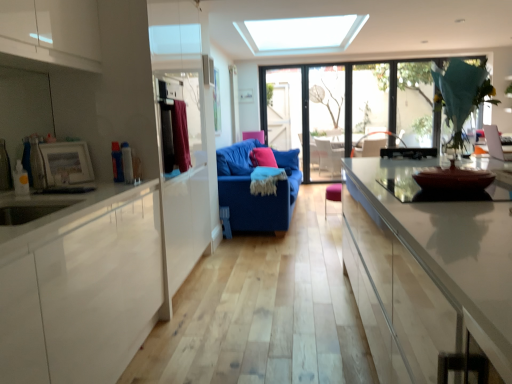
The height and width of the screenshot is (384, 512). What do you see at coordinates (281, 107) in the screenshot?
I see `blue fabric couch at center` at bounding box center [281, 107].

Locate an element on the screen. The image size is (512, 384). transparent glass window at upper right, the 2th window when ordered from left to right is located at coordinates (415, 103).

The image size is (512, 384). Identify the location of transparent glass door at center. (324, 122).

Where is `pink fabric pillow at center`? The width and height of the screenshot is (512, 384). pink fabric pillow at center is located at coordinates (263, 157).

In the scene shown: Is pink fabric pillow at center oriented away from blue fabric couch at center?

No, blue fabric couch at center is not at the back of pink fabric pillow at center.

Is pink fabric pillow at center not within blue fabric couch at center?

Yes, pink fabric pillow at center is located beyond the bounds of blue fabric couch at center.

From the image's perspective, which is above, pink fabric pillow at center or blue fabric couch at center?

blue fabric couch at center, from the image's perspective.

Which is nearer, (257,162) or (270,146)?

Point (257,162) appears to be closer to the viewer than point (270,146).

From a real-world perspective, is transparent glass window at upper right, the 2th window when ordered from left to right, positioned under pink fabric armchair at center based on gravity?

No, from a real-world perspective, transparent glass window at upper right, the 2th window when ordered from left to right, is not under pink fabric armchair at center.

Is there a large distance between transparent glass window at upper right, the 2th window when ordered from left to right, and pink fabric armchair at center?

Yes, transparent glass window at upper right, the 2th window when ordered from left to right, and pink fabric armchair at center are quite far apart.

Considering the relative sizes of transparent glass window at upper right, the 2th window when ordered from left to right, and pink fabric armchair at center in the image provided, is transparent glass window at upper right, the 2th window when ordered from left to right, bigger than pink fabric armchair at center?

Yes.

From the image's perspective, is blue fabric couch at center beneath transparent glass window at center, the second window when ordered from right to left?

No, from the image's perspective, blue fabric couch at center is not below transparent glass window at center, the second window when ordered from right to left.

Between blue fabric couch at center and transparent glass window at center, which is counted as the first window, starting from the left, which one has smaller size?

blue fabric couch at center is smaller.

Is blue fabric couch at center thinner than transparent glass window at center, the second window when ordered from right to left?

In fact, blue fabric couch at center might be wider than transparent glass window at center, the second window when ordered from right to left.

How different are the orientations of blue fabric couch at center and transparent glass window at center, which is counted as the first window, starting from the left, in degrees?

They differ by 2.46 degrees in their facing directions.

Is velvet burgundy curtain at left facing towards pink fabric armchair at center?

No, velvet burgundy curtain at left is not turned towards pink fabric armchair at center.

Is velvet burgundy curtain at left inside or outside of pink fabric armchair at center?

velvet burgundy curtain at left cannot be found inside pink fabric armchair at center.

Can you tell me how much velvet burgundy curtain at left and pink fabric armchair at center differ in facing direction?

The angular difference between velvet burgundy curtain at left and pink fabric armchair at center is 6.83 degrees.

Locate an element on the screen. The height and width of the screenshot is (384, 512). curtain lying on the left of pink fabric armchair at center is located at coordinates (180, 136).

Is transparent glass window at center, which is counted as the first window, starting from the left, not within transparent glass window at upper right, arranged as the first window when viewed from the right?

Yes.

From the image's perspective, would you say transparent glass window at center, which is counted as the first window, starting from the left, is shown under transparent glass window at upper right, arranged as the first window when viewed from the right?

Yes.

Consider the image. Is transparent glass window at center, the second window when ordered from right to left, at the right side of transparent glass window at upper right, the 2th window when ordered from left to right?

In fact, transparent glass window at center, the second window when ordered from right to left, is to the left of transparent glass window at upper right, the 2th window when ordered from left to right.

This screenshot has height=384, width=512. Identify the location of window below the transparent glass window at upper right, the 2th window when ordered from left to right (from a real-world perspective). (352, 111).

Does pink fabric armchair at center come in front of pink fabric pillow at center?

No.

Is pink fabric armchair at center positioned beyond the bounds of pink fabric pillow at center?

Absolutely, pink fabric armchair at center is external to pink fabric pillow at center.

Considering the relative sizes of pink fabric armchair at center and pink fabric pillow at center in the image provided, is pink fabric armchair at center taller than pink fabric pillow at center?

Incorrect, the height of pink fabric armchair at center is not larger of that of pink fabric pillow at center.

Is pink fabric armchair at center smaller than pink fabric pillow at center?

Actually, pink fabric armchair at center might be larger than pink fabric pillow at center.

Is transparent glass window at upper right, arranged as the first window when viewed from the right, next to transparent glass door at center?

They are not placed beside each other.

From a real-world perspective, between transparent glass window at upper right, the 2th window when ordered from left to right, and transparent glass door at center, who is vertically lower?

transparent glass door at center.

Considering the sizes of transparent glass window at upper right, arranged as the first window when viewed from the right, and transparent glass door at center in the image, is transparent glass window at upper right, arranged as the first window when viewed from the right, taller or shorter than transparent glass door at center?

Clearly, transparent glass window at upper right, arranged as the first window when viewed from the right, is shorter compared to transparent glass door at center.

You are a GUI agent. You are given a task and a screenshot of the screen. Output one action in this format:
    pyautogui.click(x=<x>, y=<y>)
    Task: Click on the glass door that is behind the transparent glass window at upper right, arranged as the first window when viewed from the right
    Image resolution: width=512 pixels, height=384 pixels.
    Given the screenshot: What is the action you would take?
    pyautogui.click(x=324, y=122)

Where is `pillow that is under the blue fabric couch at center (from a real-world perspective)`? The height and width of the screenshot is (384, 512). pillow that is under the blue fabric couch at center (from a real-world perspective) is located at coordinates point(263,157).

From a real-world perspective, which window is the 2nd one above the pink fabric armchair at center? Please provide its 2D coordinates.

[(415, 103)]

Considering their positions, is pink fabric pillow at center positioned closer to blue fabric couch at center than velvet burgundy curtain at left?

The object closer to blue fabric couch at center is pink fabric pillow at center.

Considering their positions, is blue fabric couch at center positioned further to transparent glass window at upper right, arranged as the first window when viewed from the right, than blue fabric couch at center?

blue fabric couch at center is further to transparent glass window at upper right, arranged as the first window when viewed from the right.

Based on their spatial positions, is transparent glass window at center, the second window when ordered from right to left, or blue fabric couch at center closer to brown glossy bowl at right?

transparent glass window at center, the second window when ordered from right to left.

Considering their positions, is pink fabric armchair at center positioned further to brown glossy bowl at right than transparent glass window at center, the second window when ordered from right to left?

The object further to brown glossy bowl at right is transparent glass window at center, the second window when ordered from right to left.

When comparing their distances from pink fabric pillow at center, does transparent glass window at upper right, the 2th window when ordered from left to right, or blue fabric couch at center seem closer?

blue fabric couch at center.

From the image, which object appears to be nearer to pink fabric pillow at center, transparent glass window at upper right, the 2th window when ordered from left to right, or velvet burgundy curtain at left?

Based on the image, velvet burgundy curtain at left appears to be nearer to pink fabric pillow at center.

Based on their spatial positions, is transparent glass window at center, the second window when ordered from right to left, or brown glossy bowl at right further from blue fabric couch at center?

brown glossy bowl at right is further to blue fabric couch at center.

From the image, which object appears to be farther from transparent glass window at upper right, arranged as the first window when viewed from the right, transparent glass window at center, which is counted as the first window, starting from the left, or transparent glass door at center?

The object further to transparent glass window at upper right, arranged as the first window when viewed from the right, is transparent glass door at center.

Where is `glass door located between pink fabric pillow at center and transparent glass window at center, which is counted as the first window, starting from the left, in the left-right direction`? This screenshot has width=512, height=384. glass door located between pink fabric pillow at center and transparent glass window at center, which is counted as the first window, starting from the left, in the left-right direction is located at coordinates (324, 122).

This screenshot has height=384, width=512. In order to click on studio couch located between brown glossy bowl at right and transparent glass window at center, which is counted as the first window, starting from the left, in the depth direction in this screenshot , I will do `click(257, 195)`.

At what (x,y) coordinates should I click in order to perform the action: click on pillow located between blue fabric couch at center and transparent glass door at center in the depth direction. Please return your answer as a coordinate pair (x, y). The image size is (512, 384). Looking at the image, I should click on (263, 157).

The image size is (512, 384). What are the coordinates of `window between transparent glass door at center and transparent glass window at upper right, arranged as the first window when viewed from the right` in the screenshot? It's located at (352, 111).